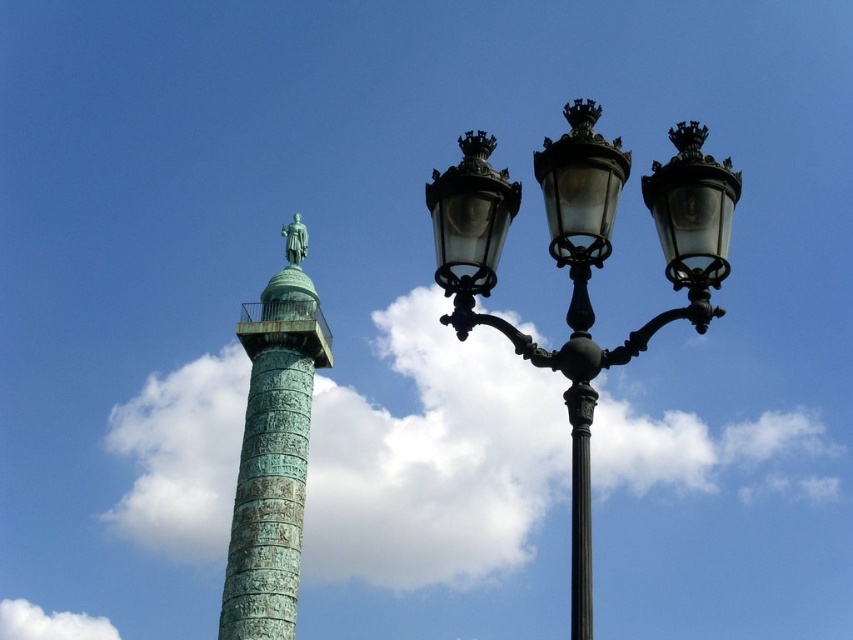
Question: Which of the following is the farthest from the observer?

Choices:
 (A) (0, 632)
 (B) (572, 509)
 (C) (473, 224)

Answer: (A)

Question: Which point appears closest to the camera in this image?

Choices:
 (A) pos(49,634)
 (B) pos(293,243)

Answer: (B)

Question: Is black metal/texture streetlamp at upper center thinner than green patinated bronze statue at upper center?

Choices:
 (A) no
 (B) yes

Answer: (A)

Question: Can you confirm if white fluffy cloud at upper center is positioned below green patinated bronze statue at upper center?

Choices:
 (A) no
 (B) yes

Answer: (B)

Question: Is green patina column at upper left thinner than white fluffy cloud at lower left?

Choices:
 (A) no
 (B) yes

Answer: (B)

Question: Which of the following is the closest to the observer?

Choices:
 (A) green patina glass streetlight at center
 (B) green patina column at upper left
 (C) white fluffy cloud at upper center
 (D) green patinated bronze statue at upper center

Answer: (C)